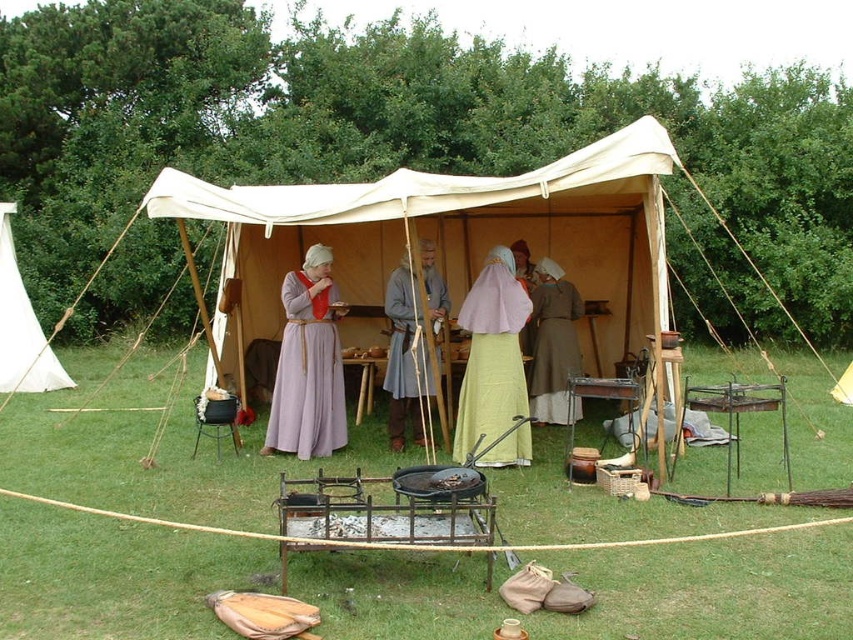
Based on the photo, who is lower down, lavender fabric dress at center or brown woolen robe at center?

lavender fabric dress at center is below.

Is lavender fabric dress at center positioned before brown woolen robe at center?

Yes, it is.

Which is behind, point (310, 264) or point (534, 394)?

Point (534, 394)

Identify the location of lavender fabric dress at center. (308, 364).

Between light yellow fabric dress at center and white canvas canopy at left, which one has more height?

Standing taller between the two is white canvas canopy at left.

Locate an element on the screen. light yellow fabric dress at center is located at coordinates (491, 355).

Does brown woolen robe at center come in front of white canvas canopy at left?

That is True.

Who is positioned more to the left, brown woolen robe at center or white canvas canopy at left?

white canvas canopy at left is more to the left.

This screenshot has width=853, height=640. What do you see at coordinates (554, 349) in the screenshot?
I see `brown woolen robe at center` at bounding box center [554, 349].

Find the location of a particular element. Image resolution: width=853 pixels, height=640 pixels. brown woolen robe at center is located at coordinates (554, 349).